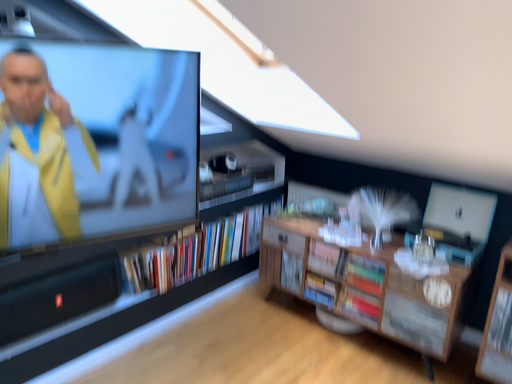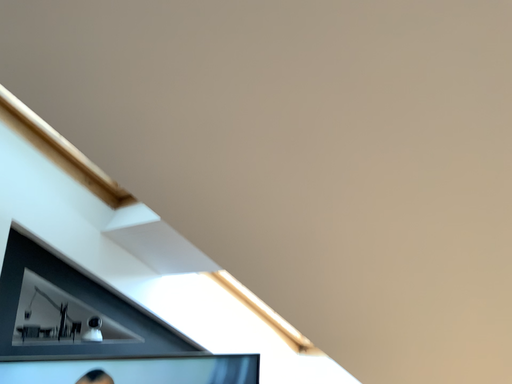
Question: Which way did the camera rotate in the video?

Choices:
 (A) rotated downward
 (B) rotated upward

Answer: (B)